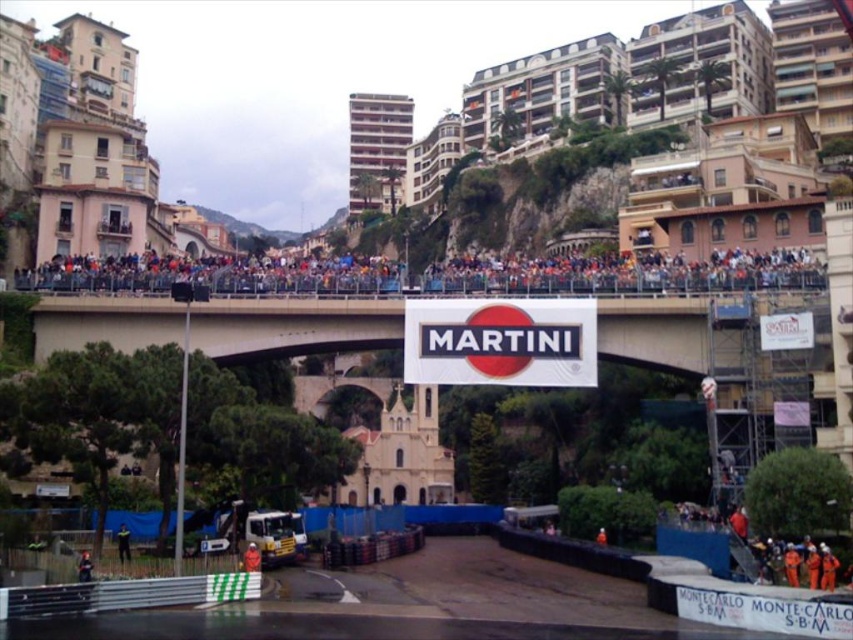
Is point (381, 264) in front of point (123, 525)?

No, it is behind (123, 525).

Is point (502, 275) positioned before point (120, 556)?

That is False.

I want to click on multicolored fabric crowd at upper center, so click(x=442, y=276).

Is point (560, 365) in front of point (119, 552)?

No, it is behind (119, 552).

In the scene shown: Who is positioned more to the left, white matte sign at center or green fabric jacket at lower left?

green fabric jacket at lower left is more to the left.

Is point (537, 340) positioned after point (122, 540)?

Yes, it is.

In order to click on white matte sign at center in this screenshot , I will do `click(500, 340)`.

How distant is white concrete bridge at center from green fabric jacket at lower left?

The distance of white concrete bridge at center from green fabric jacket at lower left is 21.35 meters.

Between white concrete bridge at center and green fabric jacket at lower left, which one has more height?

white concrete bridge at center is taller.

Image resolution: width=853 pixels, height=640 pixels. What are the coordinates of `white concrete bridge at center` in the screenshot? It's located at (293, 324).